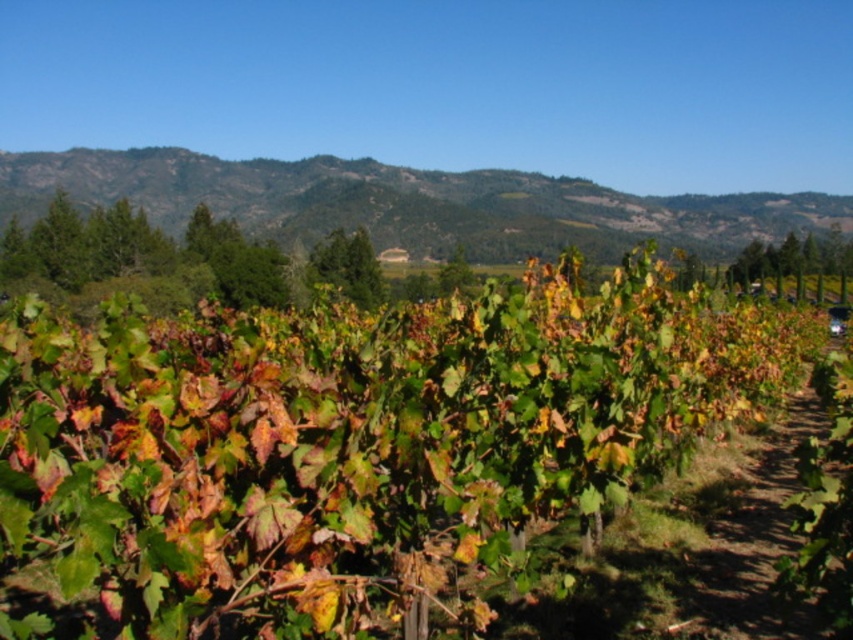
You are a hiker who wants to take a photo of the green leafy vegetation at upper center from the dirt path at center. Is the vegetation visible from the path?

The green leafy vegetation at upper center is above the dirt path at center, so yes, it is visible from the path.

You are a hiker trying to reach a viewpoint located at the upper center of the vineyard. You notice the green leafy vegetation at upper center and the dirt path at center. Which object is closer to you, and should you walk towards the closer one to reach the viewpoint efficiently?

The green leafy vegetation at upper center is closer to you than the dirt path at center. To reach the viewpoint efficiently, you should walk towards the dirt path at center since it is farther away and likely leads towards the upper center viewpoint.

You are a hiker planning to walk through the vineyard scene shown. You see the green leafy vegetation at upper center and the dirt path at center. Which of these two features is bigger in size?

The green leafy vegetation at upper center is larger in size than the dirt path at center.